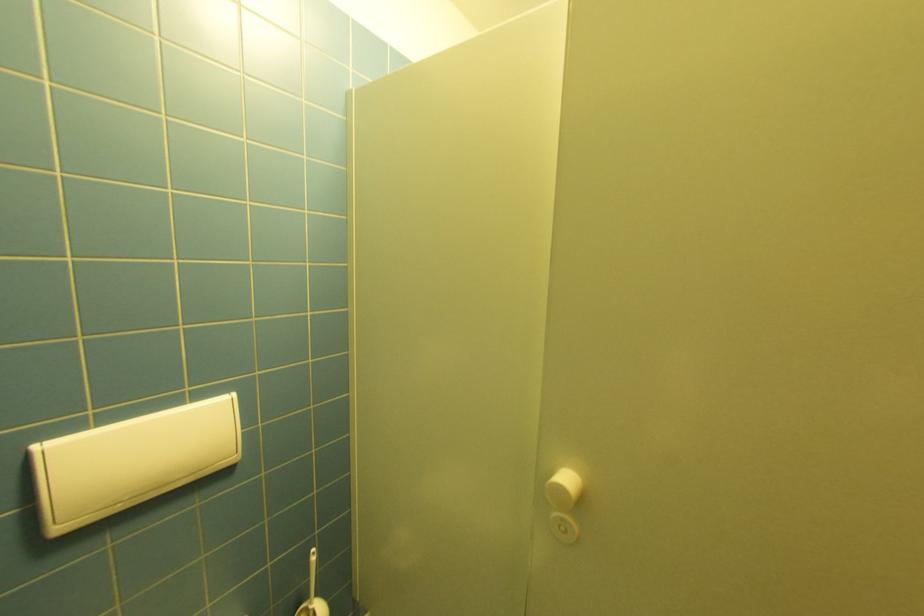
Find where to turn the white door knob. Please return your answer as a coordinate pair (x, y).

(563, 504)